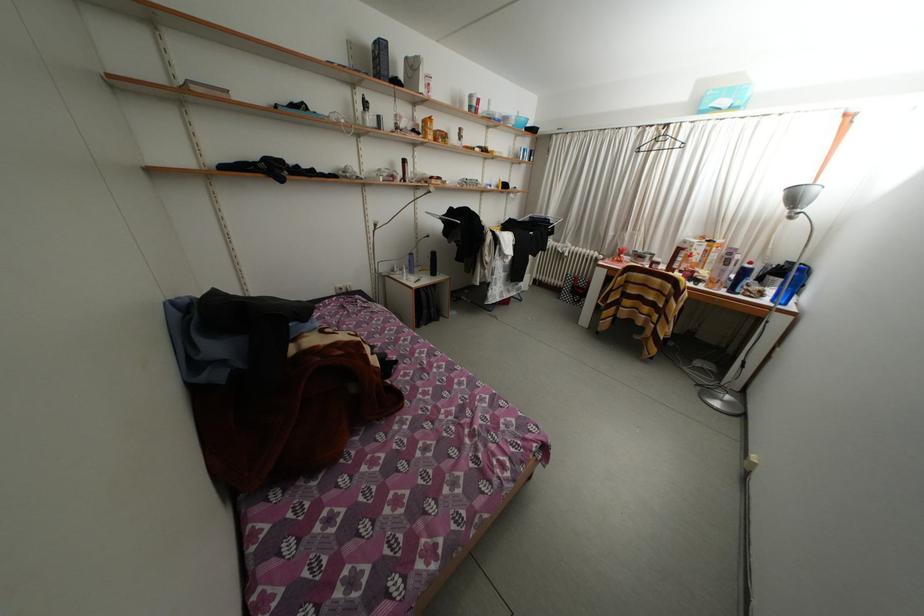
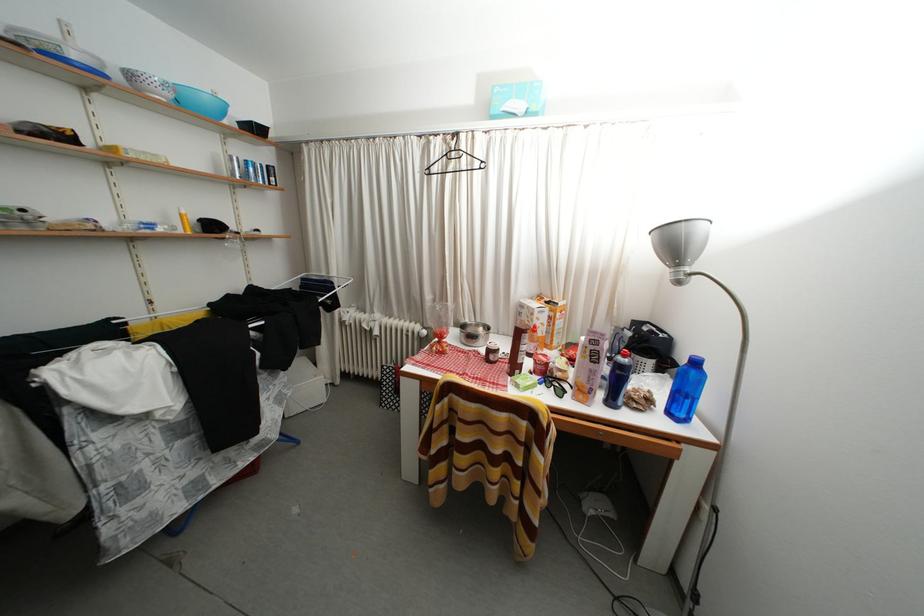
The point at (x=739, y=296) is marked in the first image. Where is the corresponding point in the second image?

(618, 408)